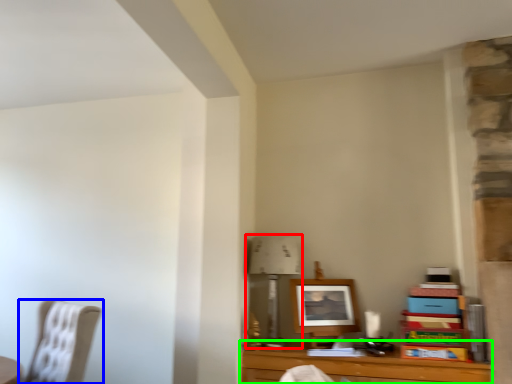
Question: Estimate the real-world distances between objects in this image. Which object is farther from table lamp (highlighted by a red box), chair (highlighted by a blue box) or table (highlighted by a green box)?

Choices:
 (A) chair
 (B) table

Answer: (A)